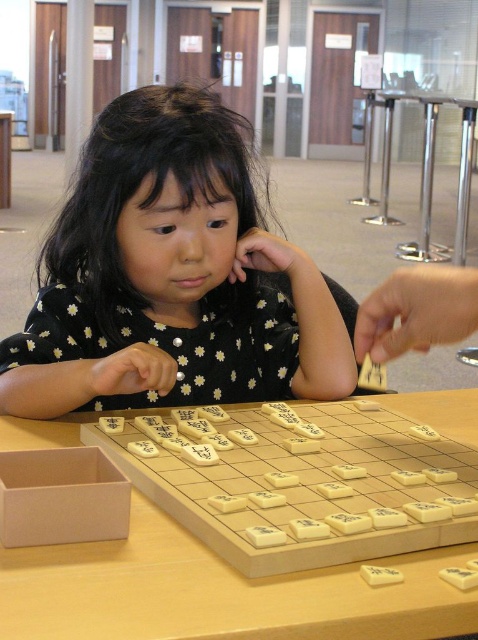
Question: From the image, what is the correct spatial relationship of black dotted dress at center in relation to wooden game board at center?

Choices:
 (A) left
 (B) right

Answer: (A)

Question: Among these objects, which one is nearest to the camera?

Choices:
 (A) black dotted dress at center
 (B) wooden game board at center

Answer: (B)

Question: Does black dotted dress at center appear on the right side of wooden game board at center?

Choices:
 (A) no
 (B) yes

Answer: (A)

Question: Is black dotted dress at center below wooden game board at center?

Choices:
 (A) no
 (B) yes

Answer: (A)

Question: Among these objects, which one is farthest from the camera?

Choices:
 (A) black dotted dress at center
 (B) wooden game board at center

Answer: (A)